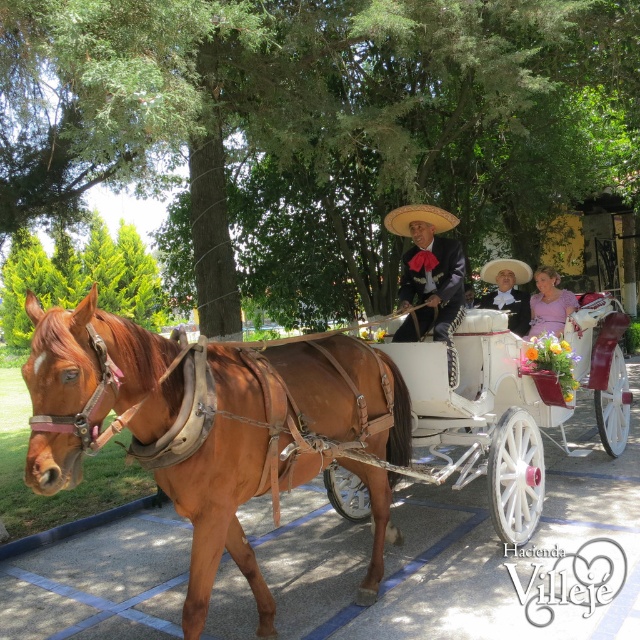
Question: Which of the following is the farthest from the observer?

Choices:
 (A) (257, 630)
 (B) (525, 266)
 (C) (545, 285)

Answer: (C)

Question: From the image, what is the correct spatial relationship of pink satin dress at center in relation to natural straw sombrero at center?

Choices:
 (A) below
 (B) above

Answer: (A)

Question: Among these points, which one is farthest from the camera?

Choices:
 (A) (493, 275)
 (B) (406, 224)
 (C) (209, 502)

Answer: (A)

Question: Is brown leather horse at left to the right of strawmaterial/texturehat at upper center from the viewer's perspective?

Choices:
 (A) yes
 (B) no

Answer: (B)

Question: Is matte black suit at center wider than pink satin dress at center?

Choices:
 (A) no
 (B) yes

Answer: (A)

Question: Which of these objects is positioned farthest from the pink satin dress at center?

Choices:
 (A) brown leather horse at left
 (B) strawmaterial/texturehat at upper center

Answer: (A)